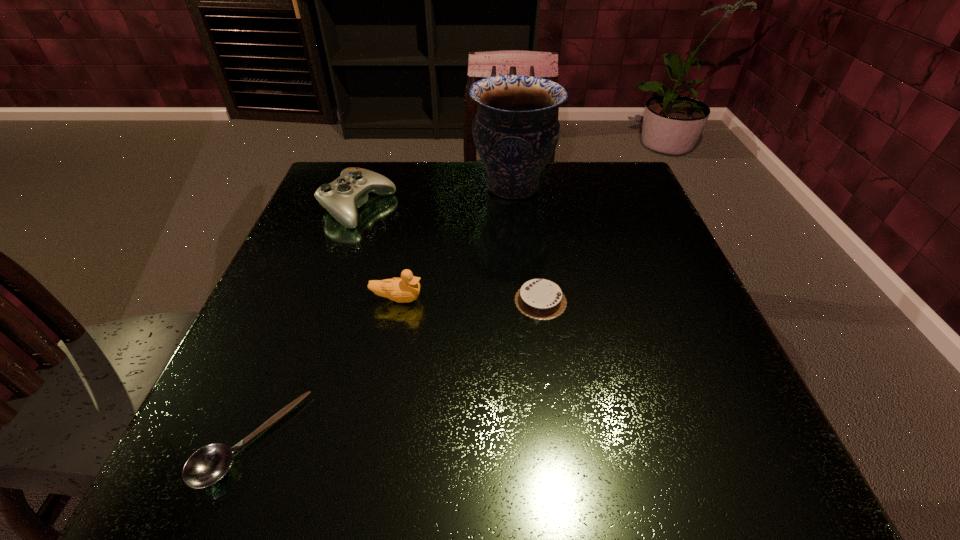
This screenshot has height=540, width=960. Identify the location of vacant area that lies between the second shortest object and the control. (449, 254).

The width and height of the screenshot is (960, 540). Find the location of `vacant region between the control and the ladle`. vacant region between the control and the ladle is located at coordinates (304, 324).

Identify the location of free point between the duckling and the chocolate cake. The height and width of the screenshot is (540, 960). (469, 300).

Find the location of `vacant space that is in between the pottery and the third object from right to left`. vacant space that is in between the pottery and the third object from right to left is located at coordinates (455, 243).

Locate an element on the screen. The width and height of the screenshot is (960, 540). free space between the control and the tallest object is located at coordinates (436, 198).

At what (x,y) coordinates should I click in order to perform the action: click on free spot between the duckling and the ladle. Please return your answer as a coordinate pair (x, y). Image resolution: width=960 pixels, height=540 pixels. Looking at the image, I should click on (324, 369).

Image resolution: width=960 pixels, height=540 pixels. What are the coordinates of `object that is the second closest to the control` in the screenshot? It's located at (407, 288).

At what (x,y) coordinates should I click in order to perform the action: click on object identified as the second closest to the control. Please return your answer as a coordinate pair (x, y). This screenshot has width=960, height=540. Looking at the image, I should click on (407, 288).

Image resolution: width=960 pixels, height=540 pixels. I want to click on vacant space that satisfies the following two spatial constraints: 1. on the back side of the fourth tallest object; 2. on the face of the duckling, so click(540, 299).

Where is `vacant space that satisfies the following two spatial constraints: 1. on the back side of the nearest object; 2. on the right side of the chocolate cake`? vacant space that satisfies the following two spatial constraints: 1. on the back side of the nearest object; 2. on the right side of the chocolate cake is located at coordinates (306, 301).